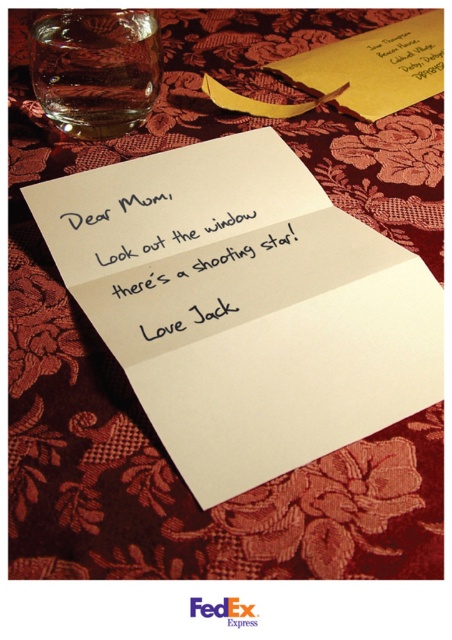
You are a postal worker sorting mail and see the white paper at center and the yellow paper envelope at upper center. Which item is narrower?

The white paper at center has a lesser width compared to the yellow paper envelope at upper center, so the white paper at center is narrower.

You are a postal worker who needs to deliver the yellow paper envelope at upper center and the colored paper note at upper right. The delivery robot can only carry items within 2 centimeters of each other. Can the robot carry both items together?

The distance between the yellow paper envelope at upper center and the colored paper note at upper right is 2.12 centimeters, which exceeds the robot delivery limit of 2 centimeters. Therefore, the robot cannot carry both items together.

You are a mail carrier who needs to deliver a letter. You see a table with a white paper at center and a colored paper note at upper right. Which paper item is on the left side?

The white paper at center is positioned on the left side of the colored paper note at upper right.